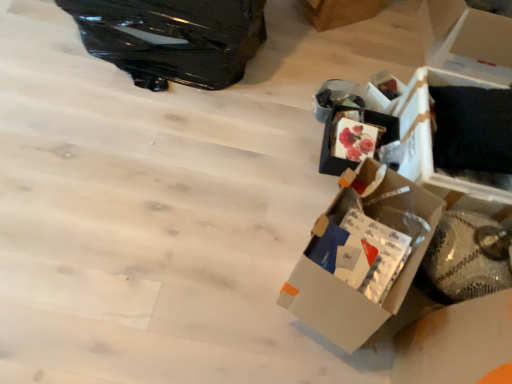
Locate an element on the screen. This screenshot has height=384, width=512. empty space that is in between white cardboard box at upper right, which is the first cardboard box from left to right, and white cardboard box at center-right is located at coordinates coord(320,88).